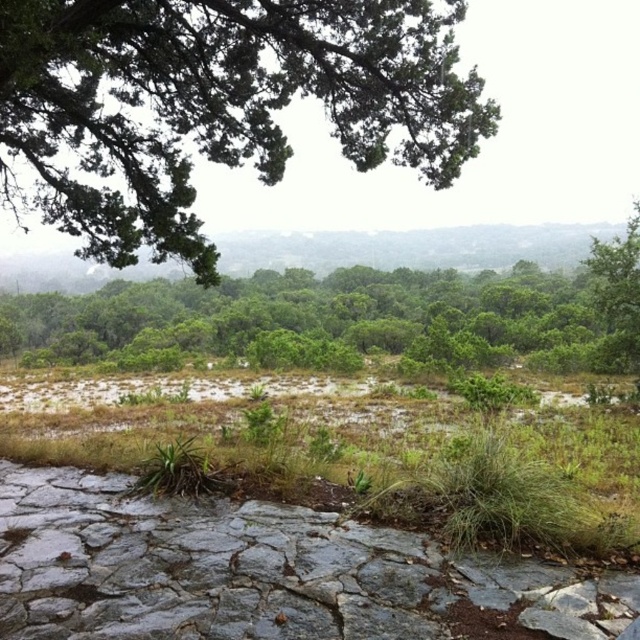
Who is more distant from viewer, (x=572, y=483) or (x=317, y=275)?

The point (x=317, y=275) is behind.

Is green grass at lower center behind green leafy tree at center?

No, green grass at lower center is closer to the viewer.

You are a GUI agent. You are given a task and a screenshot of the screen. Output one action in this format:
    pyautogui.click(x=<x>, y=<y>)
    Task: Click on the green grass at lower center
    This screenshot has width=640, height=640.
    Given the screenshot: What is the action you would take?
    pyautogui.click(x=355, y=449)

Identify the location of green grass at lower center. (355, 449).

How far apart are green textured tree at upper left and green leafy tree at center?

A distance of 28.95 meters exists between green textured tree at upper left and green leafy tree at center.

Who is shorter, green textured tree at upper left or green leafy tree at center?

green textured tree at upper left

Does point (6, 182) come in front of point (483, 276)?

Yes.

Locate an element on the screen. The image size is (640, 640). green textured tree at upper left is located at coordinates (216, 106).

Is point (61, 196) behind point (529, 515)?

Yes, it is behind point (529, 515).

Can you confirm if green textured tree at upper left is wider than green grass at lower center?

In fact, green textured tree at upper left might be narrower than green grass at lower center.

The image size is (640, 640). I want to click on green textured tree at upper left, so (x=216, y=106).